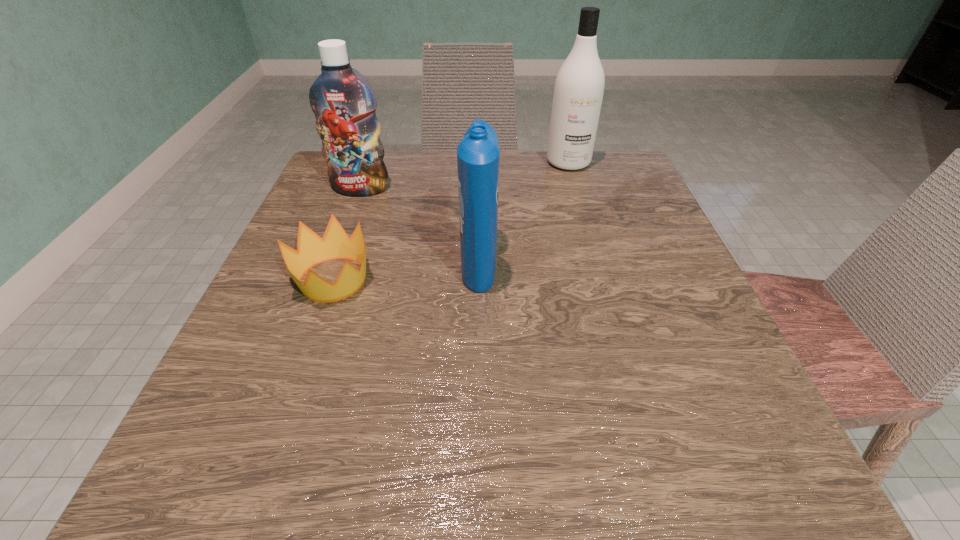
Where is `shampoo that can be found as the second closest to the second object from right to left`? The width and height of the screenshot is (960, 540). shampoo that can be found as the second closest to the second object from right to left is located at coordinates (579, 86).

Identify which shampoo is located as the nearest to the second nearest shampoo. Please provide its 2D coordinates. Your answer should be formatted as a tuple, i.e. [(x, y)], where the tuple contains the x and y coordinates of a point satisfying the conditions above.

[(478, 154)]

The image size is (960, 540). What are the coordinates of `free space in the image that satisfies the following two spatial constraints: 1. on the front label of the third nearest object; 2. on the left side of the crown` in the screenshot? It's located at (327, 279).

Locate an element on the screen. free space that satisfies the following two spatial constraints: 1. on the front label of the leftmost shampoo; 2. on the right side of the nearest shampoo is located at coordinates (333, 263).

Identify the location of free location that satisfies the following two spatial constraints: 1. on the front label of the second shampoo from right to left; 2. on the left side of the leftmost shampoo. Image resolution: width=960 pixels, height=540 pixels. (333, 263).